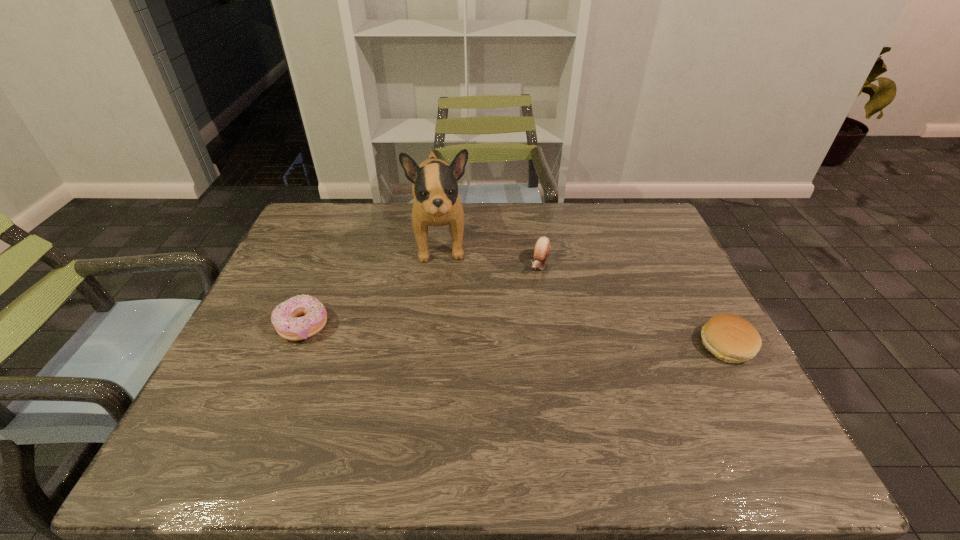
Locate an element on the screen. This screenshot has width=960, height=540. free space on the desktop that is between the doughnut and the patty and is positioned on the front-facing side of the third object from left to right is located at coordinates (507, 335).

Find the location of a particular element. The height and width of the screenshot is (540, 960). vacant space on the desktop that is between the leftmost object and the patty and is positioned at the face of the second object from left to right is located at coordinates (451, 333).